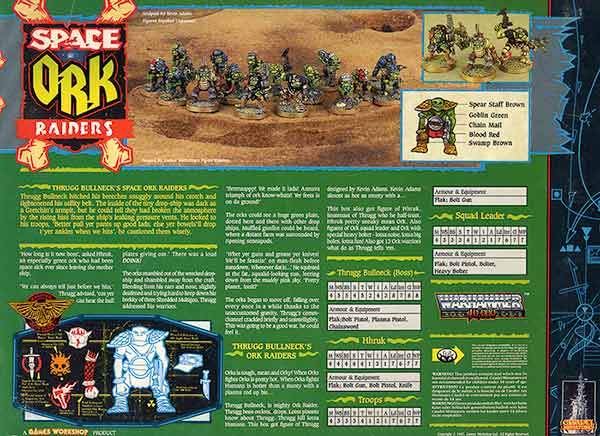
The width and height of the screenshot is (600, 436). I want to click on column 3, so click(271, 177).